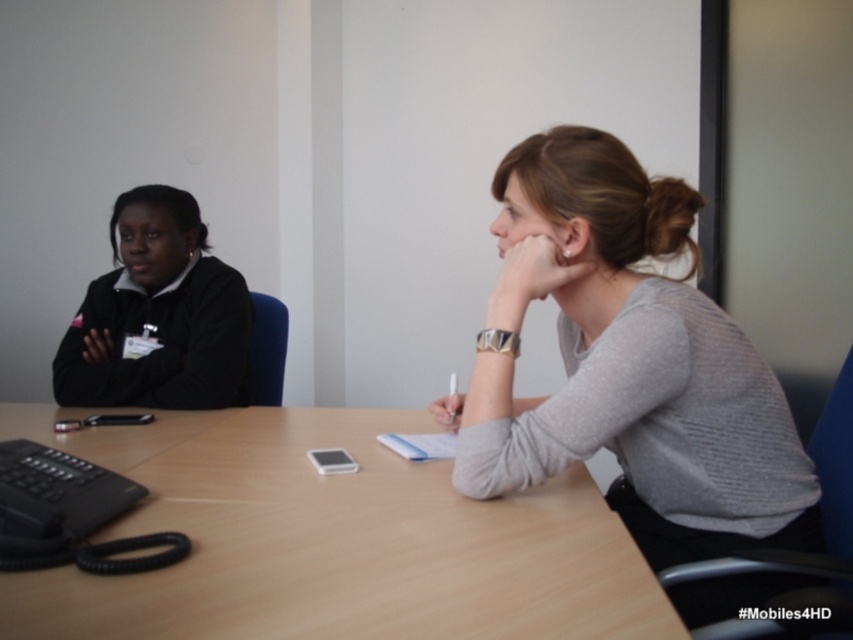
Is light brown wood table at center wider than black matte jacket at left?

Indeed, light brown wood table at center has a greater width compared to black matte jacket at left.

Who is more distant from viewer, (27,636) or (122,353)?

The point (122,353) is more distant.

Is point (206, 436) positioned before point (83, 401)?

Yes, point (206, 436) is in front of point (83, 401).

The image size is (853, 640). I want to click on light brown wood table at center, so click(x=332, y=540).

Does light brown wood table at center have a larger size compared to gray sweater at center?

No.

Does light brown wood table at center have a greater height compared to gray sweater at center?

In fact, light brown wood table at center may be shorter than gray sweater at center.

Who is more distant from viewer, (230,632) or (515,314)?

The point (515,314) is behind.

What are the coordinates of `light brown wood table at center` in the screenshot? It's located at (332, 540).

Does gray sweater at center appear on the right side of black matte jacket at left?

Correct, you'll find gray sweater at center to the right of black matte jacket at left.

Does gray sweater at center appear under black matte jacket at left?

Indeed, gray sweater at center is positioned under black matte jacket at left.

Does point (665, 236) lie behind point (73, 349)?

No, (665, 236) is closer to viewer.

Locate an element on the screen. The width and height of the screenshot is (853, 640). gray sweater at center is located at coordinates (627, 364).